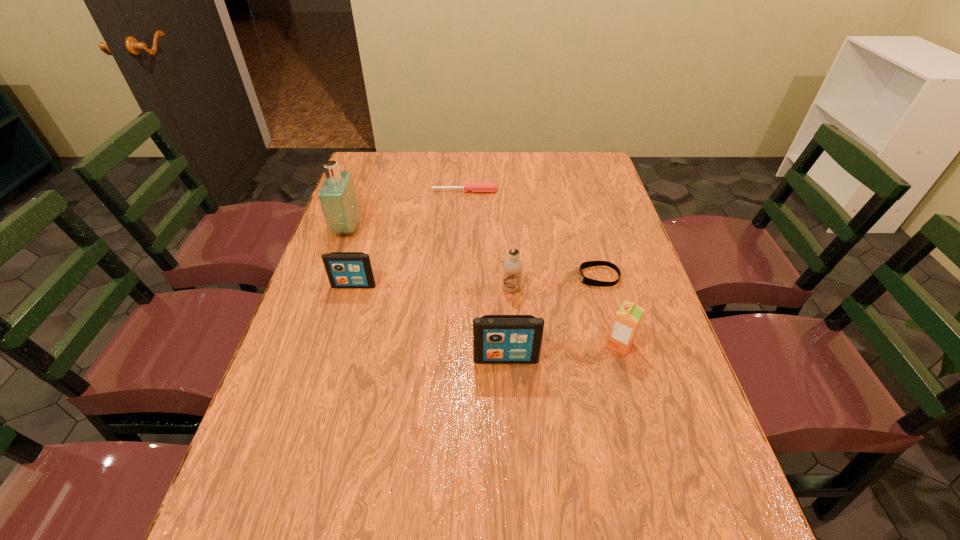
The width and height of the screenshot is (960, 540). I want to click on iPod located at the left edge, so click(344, 269).

You are a GUI agent. You are given a task and a screenshot of the screen. Output one action in this format:
    pyautogui.click(x=<x>, y=<y>)
    Task: Click on the perfume present at the left edge
    The width and height of the screenshot is (960, 540).
    Given the screenshot: What is the action you would take?
    [337, 195]

The image size is (960, 540). Identify the location of orange juice that is at the right edge. (628, 318).

Where is `wristband present at the right edge`? This screenshot has width=960, height=540. wristband present at the right edge is located at coordinates (587, 281).

Identify the location of free space at the far edge of the desktop. (548, 166).

Find the location of a particular element. The height and width of the screenshot is (540, 960). free space at the near edge of the desktop is located at coordinates (501, 451).

Where is `blank space at the left edge of the desktop`? The width and height of the screenshot is (960, 540). blank space at the left edge of the desktop is located at coordinates (347, 321).

The width and height of the screenshot is (960, 540). Identify the location of vacant area at the right edge. (670, 363).

Where is `free space at the far left corner`? free space at the far left corner is located at coordinates (367, 151).

Locate an element on the screen. Image resolution: width=960 pixels, height=540 pixels. free region at the far right corner of the desktop is located at coordinates (561, 161).